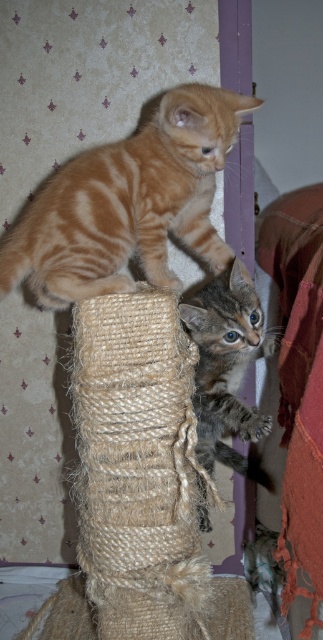
Question: Is orange striped kitten at upper left smaller than tabby fur cat at center?

Choices:
 (A) yes
 (B) no

Answer: (B)

Question: Does orange striped kitten at upper left appear on the left side of tabby fur cat at center?

Choices:
 (A) no
 (B) yes

Answer: (B)

Question: Among these points, which one is nearest to the camera?

Choices:
 (A) (176, 189)
 (B) (239, 266)

Answer: (A)

Question: Does orange striped kitten at upper left appear on the right side of tabby fur cat at center?

Choices:
 (A) yes
 (B) no

Answer: (B)

Question: Which point is closer to the camera?

Choices:
 (A) orange striped kitten at upper left
 (B) tabby fur cat at center

Answer: (A)